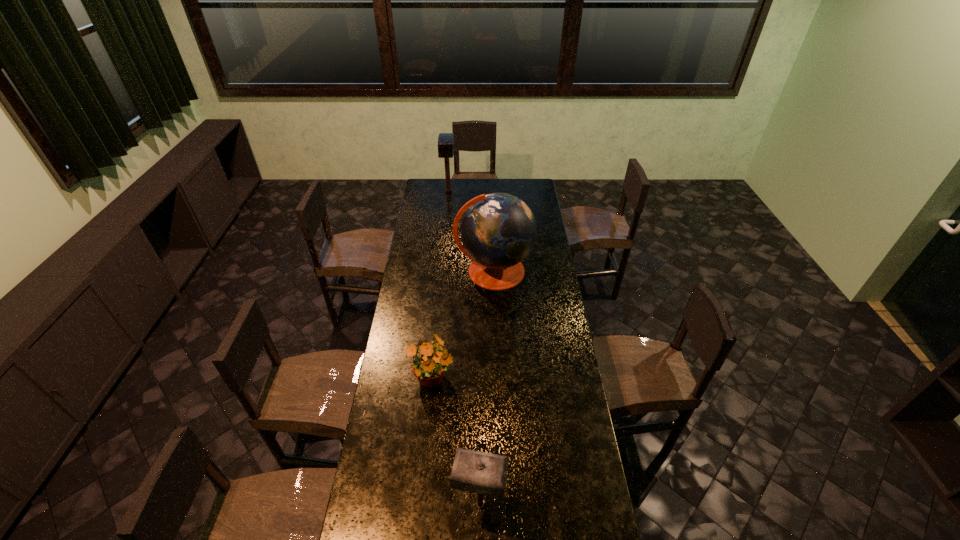
Identify the location of the third nearest object. This screenshot has width=960, height=540. pyautogui.click(x=498, y=230).

I want to click on the tallest object, so click(x=498, y=230).

Find the location of a particular element. the farthest object is located at coordinates (445, 140).

The height and width of the screenshot is (540, 960). In order to click on the third shortest object in this screenshot , I will do `click(445, 140)`.

Locate an element on the screen. This screenshot has width=960, height=540. the right mallet is located at coordinates (484, 473).

I want to click on the nearer mallet, so click(x=484, y=473).

In order to click on the shortest object in this screenshot , I will do `click(429, 365)`.

Identify the location of flowerpot. (429, 365).

Find the location of a particular element. The width and height of the screenshot is (960, 540). vacant space located 0.280m with the Americas facing the viewer on the tallest object is located at coordinates (496, 340).

Locate an element on the screen. vacant area situated 0.110m on the front of the left mallet is located at coordinates (447, 209).